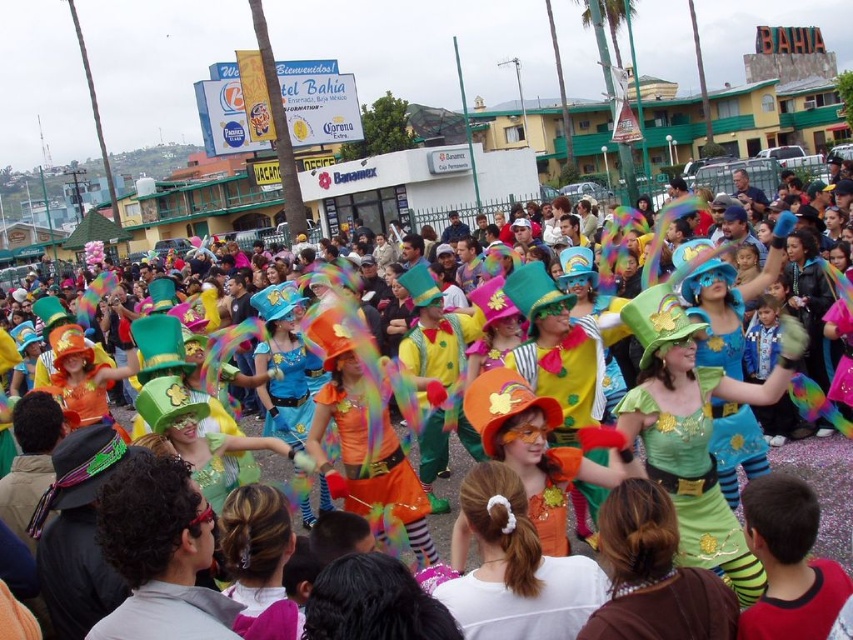
You are a photographer trying to capture a photo of the green satin dress at center and the shiny green hat at center. Which object should you focus on first if you want to highlight the taller one?

The shiny green hat at center is taller than the green satin dress at center, so you should focus on the shiny green hat at center first to highlight its height.

You are a photographer trying to capture the performer in the green satin dress at center and the shiny green hat at center. Since both are green, you want to ensure you can distinguish them in your photo. Based on their positions, which one will appear closer to the camera in the image?

The green satin dress at center is in front of the shiny green hat at center, so in the photo, the green satin dress at center will appear closer to the camera than the shiny green hat at center.

You are a photographer standing at the edge of the street. You want to capture a photo that includes both the orange satin dress at center and the shiny green hat at center. What is the minimum distance you need to move backward to ensure both are in frame?

The orange satin dress at center and the shiny green hat at center are 21.64 feet apart. To include both in the frame, you need to move backward until your camera can capture a field of view that accommodates this distance. Assuming an average camera field of view, moving back approximately 25 feet should ensure both elements are within the frame.